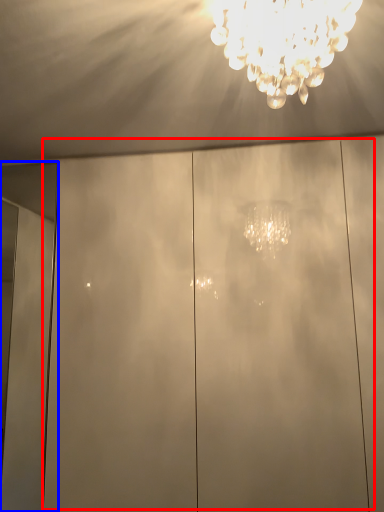
Question: Which object is closer to the camera taking this photo, glass door (highlighted by a red box) or door (highlighted by a blue box)?

Choices:
 (A) glass door
 (B) door

Answer: (A)